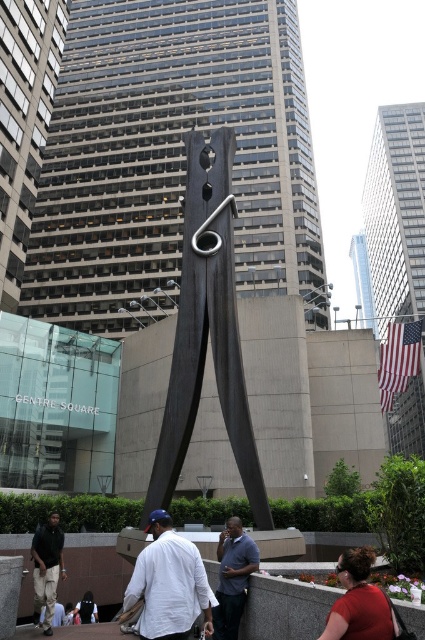
You are a photographer standing near the sculpture and want to capture both the white matte shirt at center and the dark blue shirt at center in the same frame. Which of the two shirts should you focus on to ensure both are in the shot?

You should focus on the white matte shirt at center because it is positioned over the dark blue shirt at center, meaning both will be visible in the frame when centered on the upper shirt.

You are a photographer trying to capture the dark wood clothespin at center and the white matte shirt at center in the same frame. Which object should you focus on first if you want to ensure both are in focus without adjusting your camera settings?

You should focus on the dark wood clothespin at center first because it is taller than the white matte shirt at center, so focusing on the taller object will help keep both in focus.

You are standing at the center of the urban scene with the large clothespin sculpture. You need to locate the person wearing the white matte shirt at center. According to the coordinates provided, where would you look to find them?

The white matte shirt at center is located at the coordinates point (169, 582), so you should look towards the lower right area of the scene since the x coordinate is high and the y coordinate is relatively low.